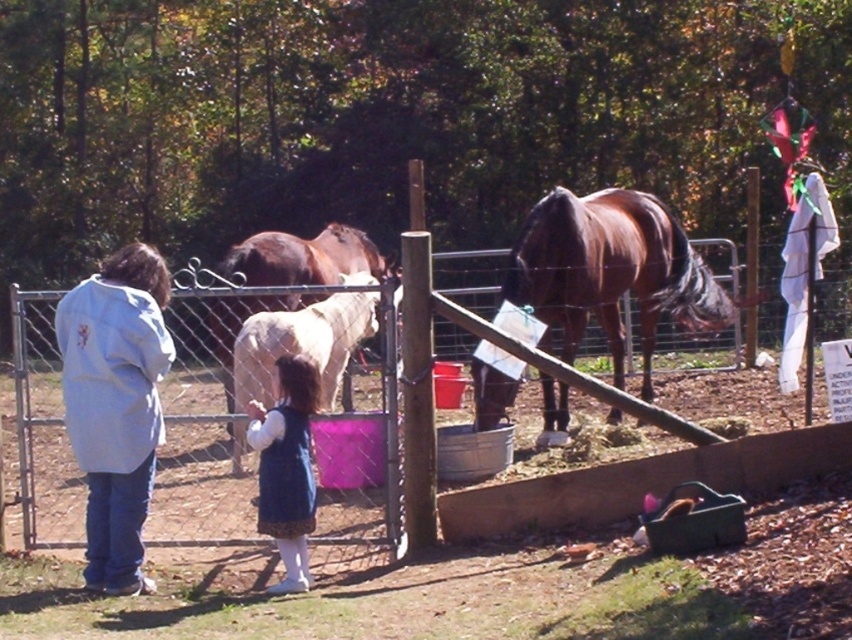
Question: Is white cotton jacket at left further to the viewer compared to blue velvet dress at center?

Choices:
 (A) no
 (B) yes

Answer: (A)

Question: Does metal wire fence at center lie in front of brown glossy horse at center?

Choices:
 (A) no
 (B) yes

Answer: (B)

Question: Is brown glossy horse at center below blue velvet dress at center?

Choices:
 (A) yes
 (B) no

Answer: (B)

Question: Which object is closer to the camera taking this photo?

Choices:
 (A) white cotton jacket at left
 (B) blue velvet dress at center

Answer: (A)

Question: Which point appears closest to the camera in this image?

Choices:
 (A) pyautogui.click(x=554, y=413)
 (B) pyautogui.click(x=712, y=365)
 (C) pyautogui.click(x=256, y=268)
 (D) pyautogui.click(x=249, y=422)

Answer: (D)

Question: Which point is closer to the camera?

Choices:
 (A) (327, 448)
 (B) (625, 289)

Answer: (A)